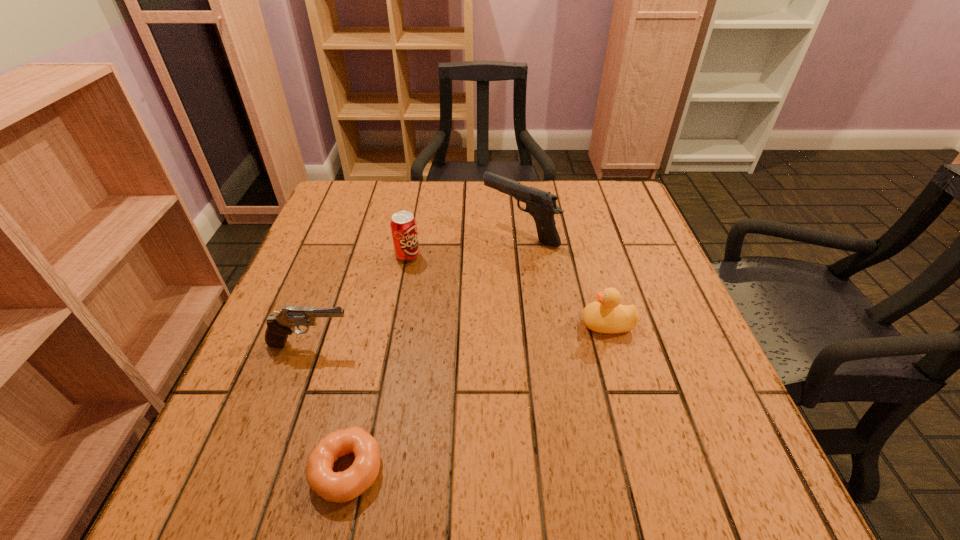
Image resolution: width=960 pixels, height=540 pixels. Identify the location of the tallest object. (541, 205).

Find the location of a particular element. This screenshot has height=540, width=960. gun is located at coordinates (541, 205).

Identify the location of soda. The width and height of the screenshot is (960, 540). (403, 225).

Locate an element on the screen. Image resolution: width=960 pixels, height=540 pixels. the fourth farthest object is located at coordinates (279, 326).

At what (x,y) coordinates should I click in order to perform the action: click on the third farthest object. Please return your answer as a coordinate pair (x, y). Looking at the image, I should click on (606, 315).

Identify the location of the rightmost object. (606, 315).

Image resolution: width=960 pixels, height=540 pixels. I want to click on the shortest object, so click(x=340, y=487).

Image resolution: width=960 pixels, height=540 pixels. In order to click on the nearest object in this screenshot , I will do `click(340, 487)`.

Identify the location of vacant space located 0.160m at the muzzle of the fourth object from left to right. The height and width of the screenshot is (540, 960). (420, 232).

Find the location of a particular element. The image size is (960, 540). blank space located at the muzzle of the fourth object from left to right is located at coordinates (362, 232).